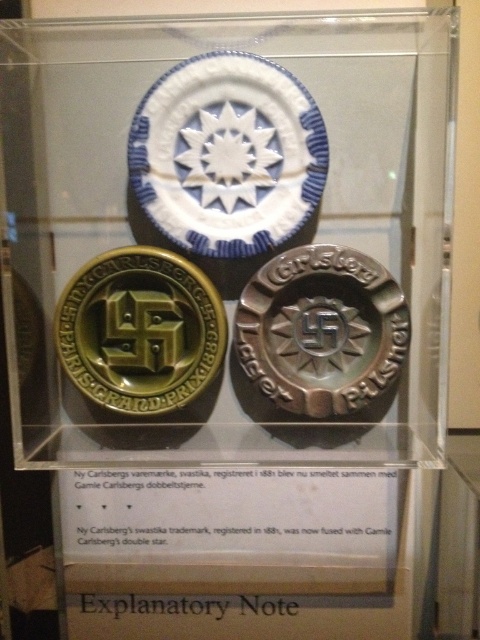
Question: Among these objects, which one is farthest from the camera?

Choices:
 (A) gold matte swastika at left
 (B) brushed metal badge at center

Answer: (A)

Question: Which point is closer to the camera taking this photo?

Choices:
 (A) (397, 332)
 (B) (215, 304)

Answer: (A)

Question: Which point appears farthest from the camera in this image?

Choices:
 (A) (143, 310)
 (B) (260, 371)

Answer: (A)

Question: Does brushed metal badge at center come behind gold matte swastika at left?

Choices:
 (A) yes
 (B) no

Answer: (B)

Question: Can you confirm if brushed metal badge at center is bigger than gold matte swastika at left?

Choices:
 (A) yes
 (B) no

Answer: (A)

Question: Can you confirm if brushed metal badge at center is positioned to the right of gold matte swastika at left?

Choices:
 (A) no
 (B) yes

Answer: (B)